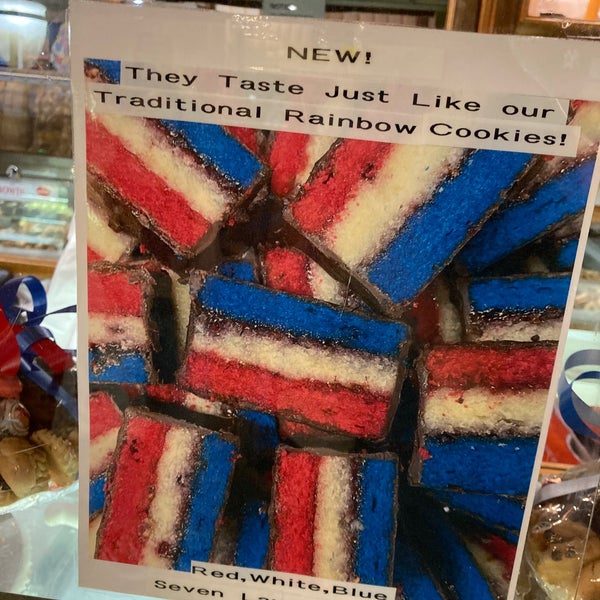
I want to click on corkboard, so click(x=592, y=7).